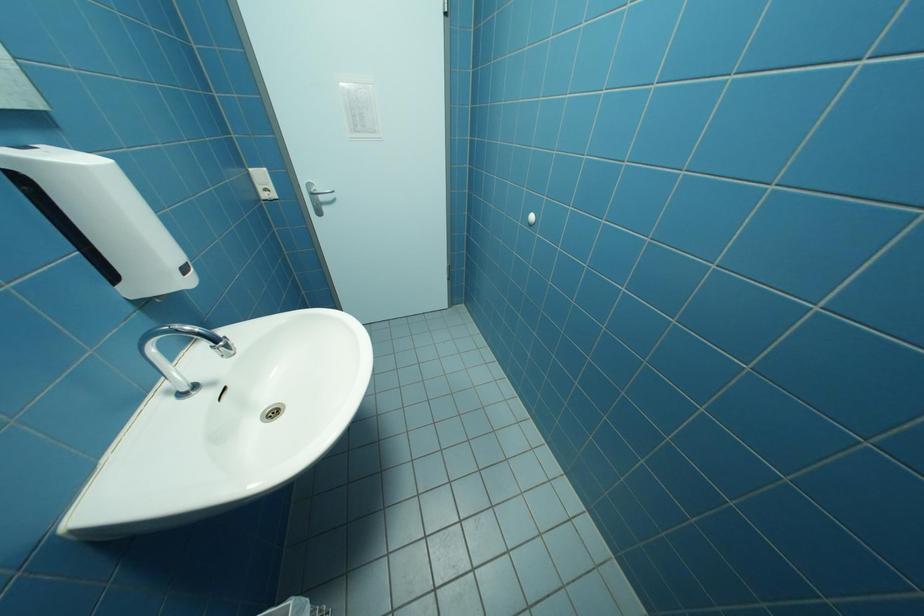
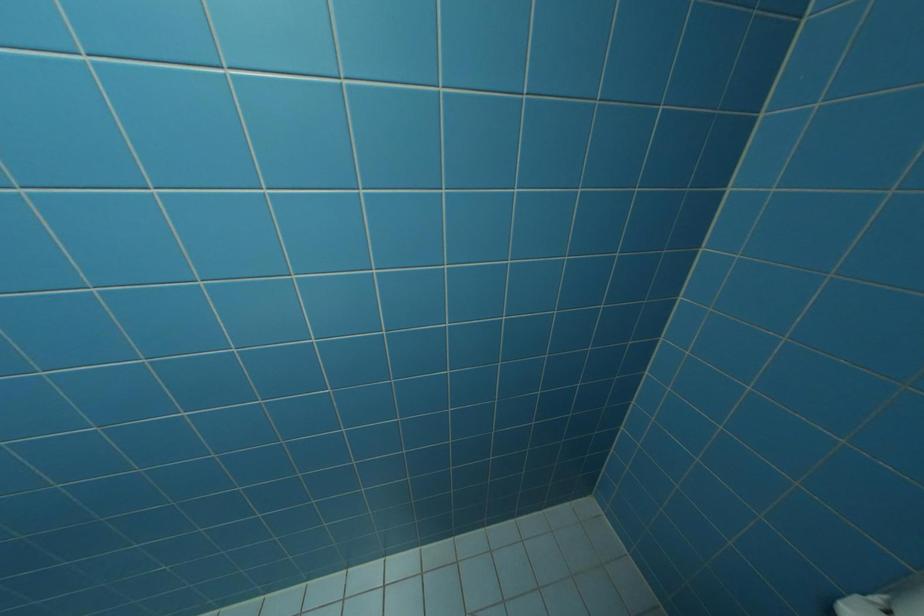
Based on the continuous images, in which direction is the camera rotating?

The camera's rotation is toward right-down.